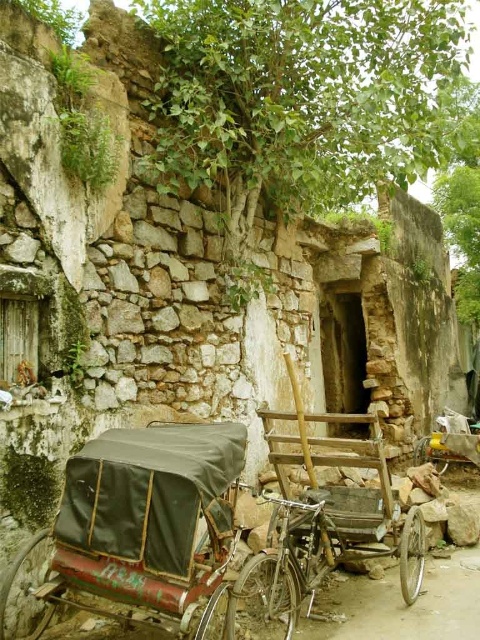
Question: Does rusty metal rickshaw at lower left have a larger size compared to rusty metal rickshaw at center?

Choices:
 (A) yes
 (B) no

Answer: (B)

Question: Which object appears closest to the camera in this image?

Choices:
 (A) rusty metal rickshaw at center
 (B) rusty metal rickshaw at lower left

Answer: (B)

Question: Among these points, which one is nearest to the camera?

Choices:
 (A) click(61, 493)
 (B) click(416, 536)

Answer: (A)

Question: Observing the image, what is the correct spatial positioning of rusty metal rickshaw at lower left in reference to rusty metal rickshaw at center?

Choices:
 (A) below
 (B) above

Answer: (B)

Question: Does rusty metal rickshaw at lower left lie in front of rusty metal rickshaw at center?

Choices:
 (A) yes
 (B) no

Answer: (A)

Question: Which point appears farthest from the camera in this image?

Choices:
 (A) (228, 621)
 (B) (84, 545)

Answer: (A)